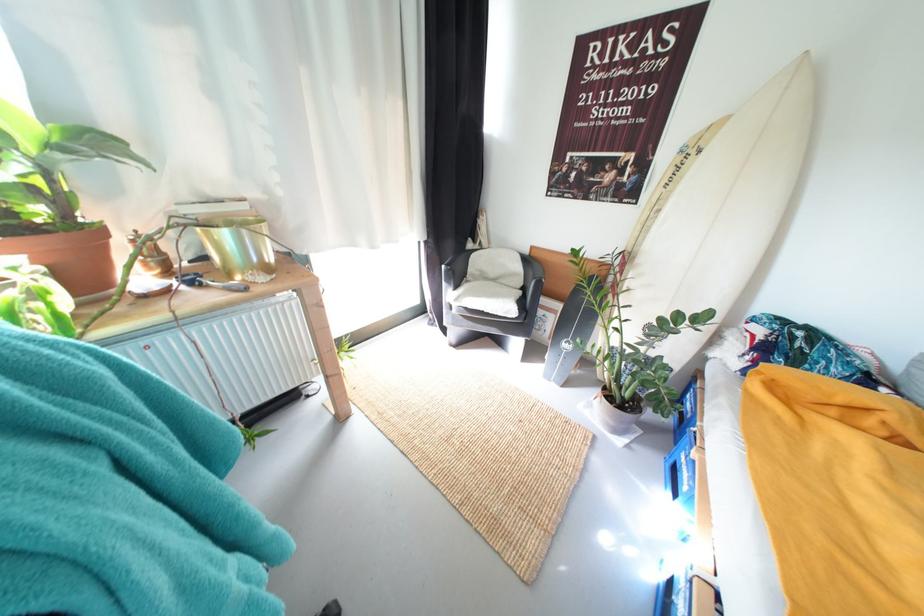
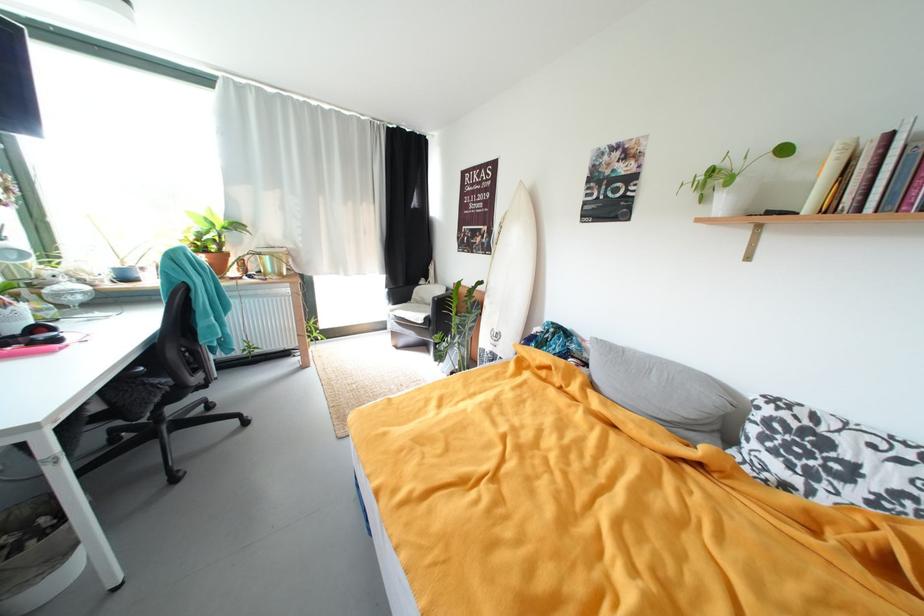
Where in the second image is the point corresponding to point 221,195 from the first image?

(281, 246)